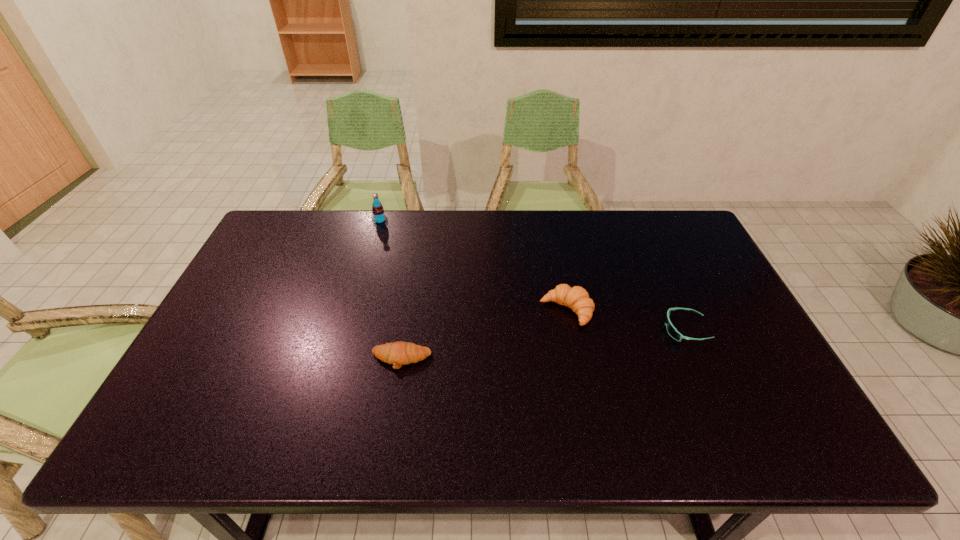
Identify the location of the tallest object. (378, 217).

Identify the location of the leftmost object. (378, 217).

Identify the location of the third object from left to right. (577, 298).

This screenshot has height=540, width=960. I want to click on the third shortest object, so click(577, 298).

Locate an element on the screen. This screenshot has height=540, width=960. the shorter crescent roll is located at coordinates 399,353.

Where is `the left crescent roll`? the left crescent roll is located at coordinates (399, 353).

Image resolution: width=960 pixels, height=540 pixels. Identify the location of the rightmost object. (672, 331).

Find the location of a particular element. vacant area situated on the front of the farthest object is located at coordinates (368, 262).

Locate an element on the screen. Image resolution: width=960 pixels, height=540 pixels. vacant space located on the left of the right crescent roll is located at coordinates (413, 310).

The image size is (960, 540). What are the coordinates of `free spot located 0.270m on the left of the shorter crescent roll` in the screenshot? It's located at (265, 360).